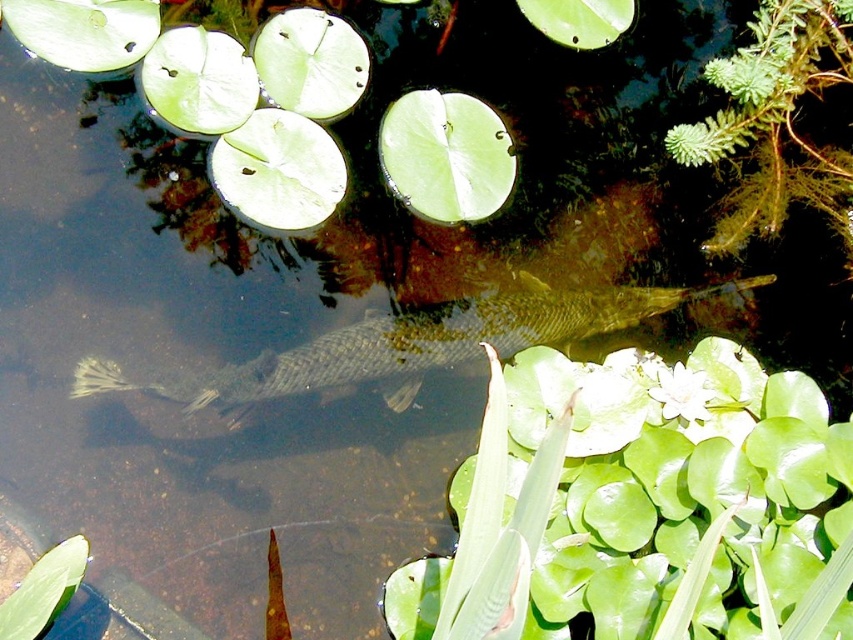
Question: Considering the real-world distances, which object is farthest from the green leafy plant at lower left?

Choices:
 (A) green fuzzy plant at upper right
 (B) shiny silver fish at center
 (C) green glossy leaf at center

Answer: (A)

Question: Which of these objects is positioned farthest from the shiny silver fish at center?

Choices:
 (A) green fuzzy plant at upper right
 (B) green glossy leaf at center

Answer: (B)

Question: Does green glossy leaf at center have a lesser width compared to green leafy plant at lower left?

Choices:
 (A) no
 (B) yes

Answer: (A)

Question: Based on their relative distances, which object is nearer to the green leafy plant at lower left?

Choices:
 (A) green fuzzy plant at upper right
 (B) shiny silver fish at center
 (C) green glossy leaf at center

Answer: (B)

Question: Can you confirm if green glossy leaf at center is thinner than green fuzzy plant at upper right?

Choices:
 (A) yes
 (B) no

Answer: (B)

Question: From the image, what is the correct spatial relationship of shiny silver fish at center in relation to green fuzzy plant at upper right?

Choices:
 (A) below
 (B) above

Answer: (A)